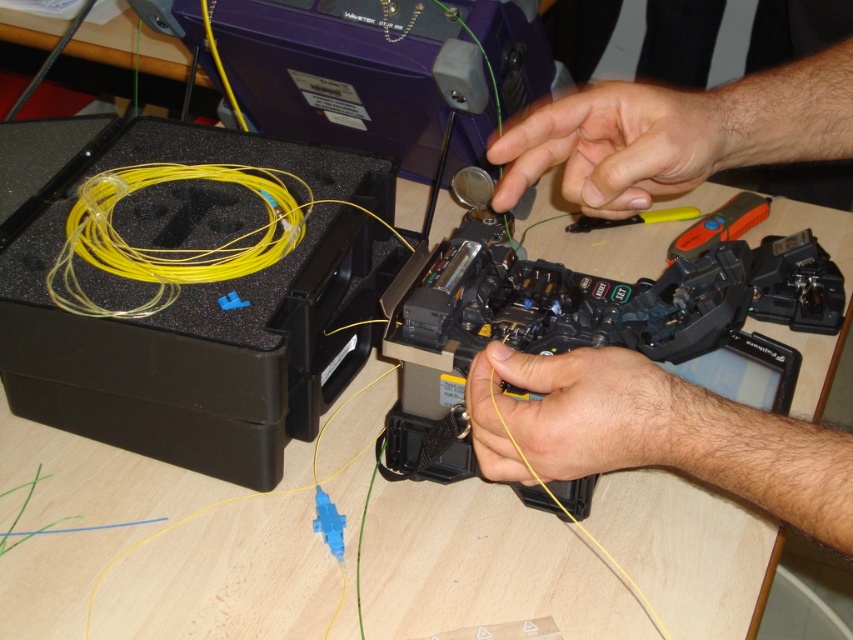
Question: Which of the following is the closest to the observer?

Choices:
 (A) (735, 198)
 (B) (674, 184)

Answer: (B)

Question: Which point is closer to the camera taking this photo?

Choices:
 (A) (672, 211)
 (B) (633, 154)

Answer: (B)

Question: Is the position of smooth yellow wire at center more distant than that of smooth skin at center?

Choices:
 (A) yes
 (B) no

Answer: (B)

Question: Can you confirm if smooth yellow wire at center is positioned to the right of yellow matte wire at center?

Choices:
 (A) yes
 (B) no

Answer: (A)

Question: Is smooth yellow wire at center positioned at the back of yellow matte wire at center?

Choices:
 (A) yes
 (B) no

Answer: (B)

Question: Which point is farther to the camera?

Choices:
 (A) (656, 440)
 (B) (762, 212)
 (C) (509, 156)
 (D) (564, 426)

Answer: (B)